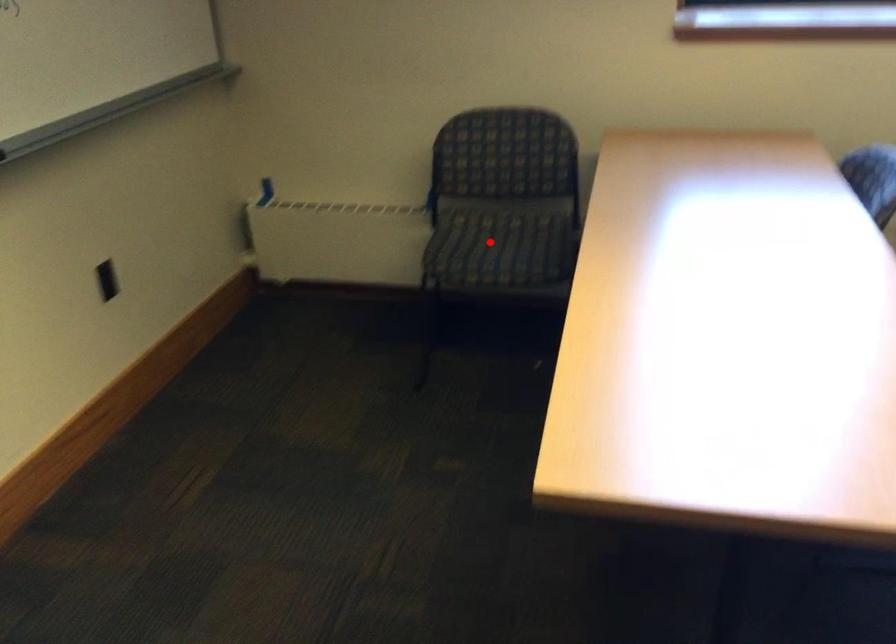
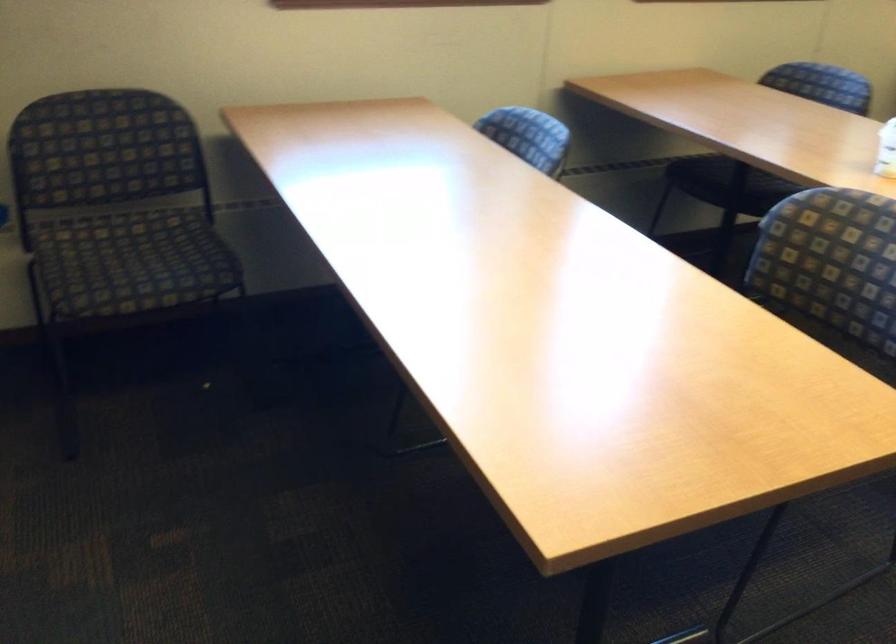
Question: I am providing you with two images of the same scene from different viewpoints. Given a red point in image1, look at the same physical point in image2. Is it:

Choices:
 (A) Closer to the viewpoint
 (B) Farther from the viewpoint

Answer: (A)